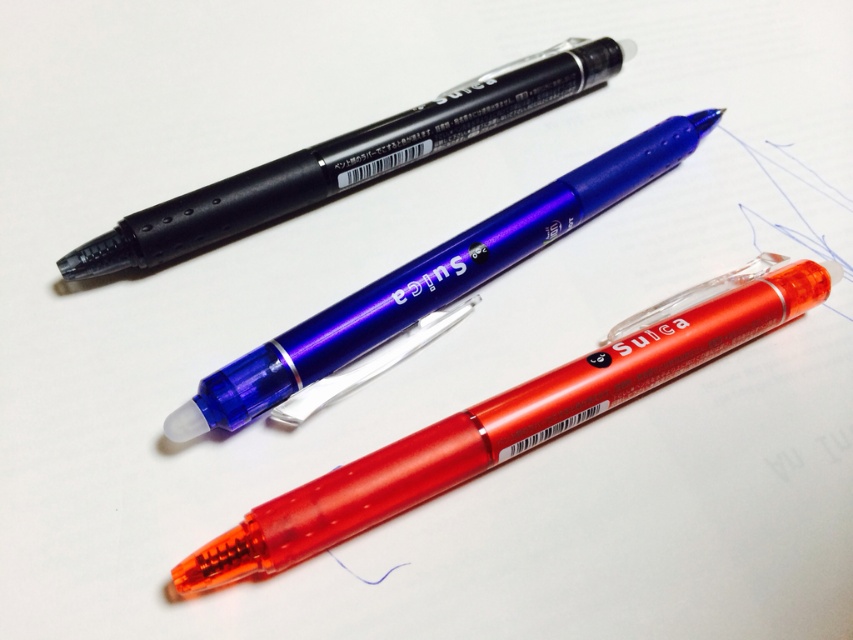
You are organizing a stationery drawer and need to place the transparent orange pen at center. Based on its position in the image, where should you place it relative to the other pens?

The transparent orange pen at center is located at point (494, 432), which places it centrally among the other pens. Therefore, you should position it in the middle of the drawer to maintain its central placement as shown in the image.

You are organizing a desk and need to place a new pen that is 8 inches long between the translucent blue pen at center and the matte black pen at upper center. Will there be enough space?

The distance between the translucent blue pen at center and the matte black pen at upper center is 7.58 inches. Since the new pen is 8 inches long, it will not fit in the available space.

You are organizing a stationery drawer and need to place the transparent orange pen at center and the translucent blue pen at center. Given that the drawer has a height limit of 5 cm, can both pens fit vertically without exceeding the height limit?

The transparent orange pen at center is shorter than the translucent blue pen at center. Since the drawer has a height limit of 5 cm, both pens can fit vertically if the tallest pen, the translucent blue pen at center, is within the 5 cm limit. However, without knowing the exact height of the translucent blue pen at center, we cannot definitively confirm if they will fit.